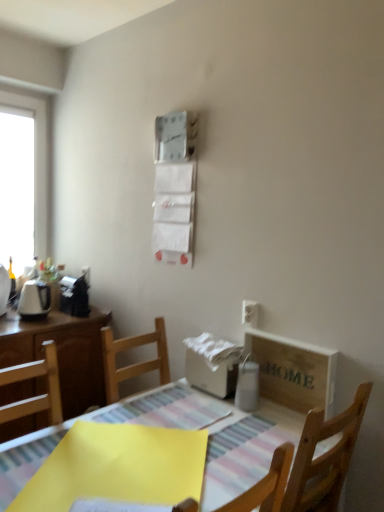
You are a GUI agent. You are given a task and a screenshot of the screen. Output one action in this format:
    pyautogui.click(x=<x>, y=<y>)
    Task: Click on the free point above wooden table at center (from a real-world perspective)
    The image size is (384, 512).
    Given the screenshot: What is the action you would take?
    pyautogui.click(x=170, y=447)